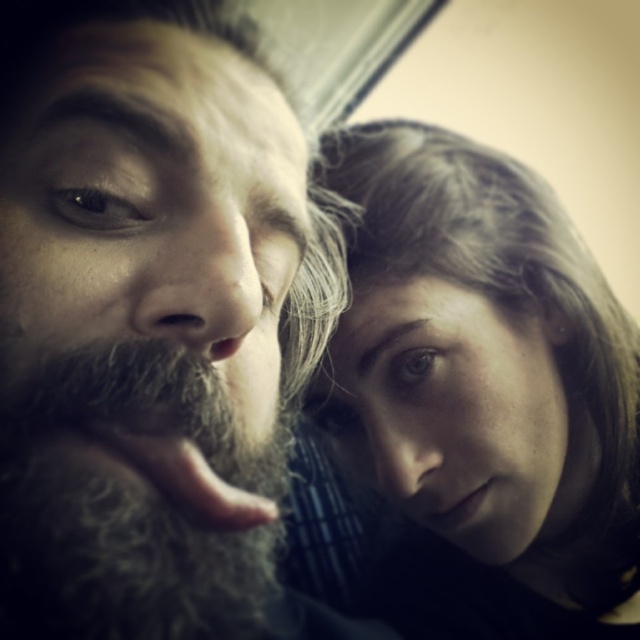
Question: Among these points, which one is nearest to the camera?

Choices:
 (A) (184, 364)
 (B) (480, 541)
 (C) (26, 564)

Answer: (C)

Question: Does smooth brown hair at upper right appear on the left side of gray fuzzy beard at left?

Choices:
 (A) no
 (B) yes

Answer: (A)

Question: Which object is the closest to the smooth skin face at center?

Choices:
 (A) dark brown beard at left
 (B) gray fuzzy beard at left

Answer: (A)

Question: Is gray fuzzy beard at left wider than smooth skin face at center?

Choices:
 (A) yes
 (B) no

Answer: (B)

Question: Does smooth brown hair at upper right have a lesser width compared to smooth skin face at center?

Choices:
 (A) yes
 (B) no

Answer: (B)

Question: Which of these objects is positioned farthest from the smooth skin face at center?

Choices:
 (A) gray fuzzy beard at left
 (B) smooth brown hair at upper right
 (C) dark brown beard at left

Answer: (A)